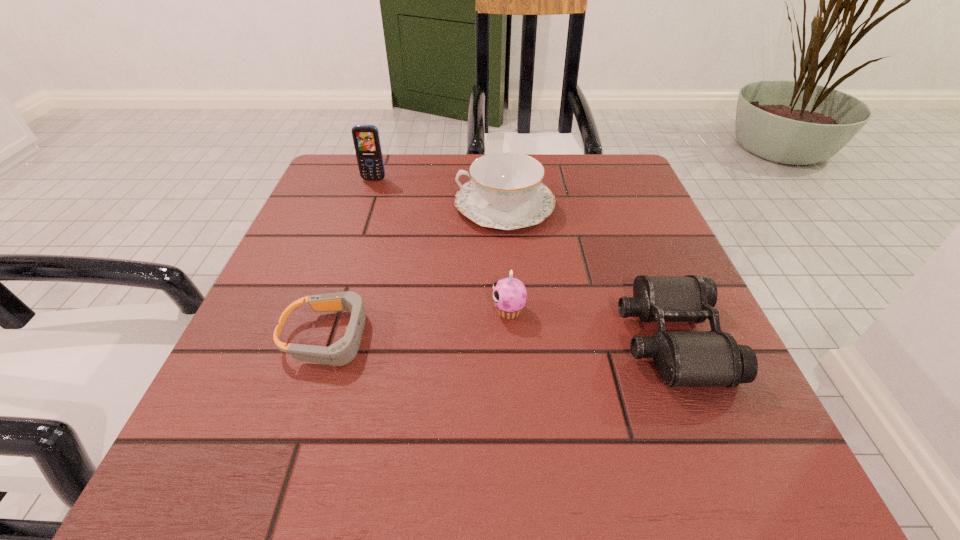
Find the location of a particular element. goggles situated at the left edge is located at coordinates (342, 352).

Find the location of a particular element. The height and width of the screenshot is (540, 960). object at the right edge is located at coordinates (683, 358).

This screenshot has width=960, height=540. In order to click on object located in the far left corner section of the desktop in this screenshot , I will do `click(366, 139)`.

The height and width of the screenshot is (540, 960). I want to click on vacant space at the near edge, so click(x=490, y=459).

I want to click on vacant space at the left edge, so click(x=262, y=320).

Find the location of a particular element. The image size is (960, 540). free spot at the right edge of the desktop is located at coordinates pos(611,240).

This screenshot has width=960, height=540. I want to click on vacant space at the far left corner of the desktop, so click(316, 199).

This screenshot has height=540, width=960. I want to click on free space at the near left corner, so click(198, 463).

Identify the location of vacant point at the far right corner. (622, 160).

In the image, there is a desktop. At what (x,y) coordinates should I click in order to perform the action: click on blank space at the near right corner. Please return your answer as a coordinate pair (x, y). This screenshot has height=540, width=960. Looking at the image, I should click on (756, 462).